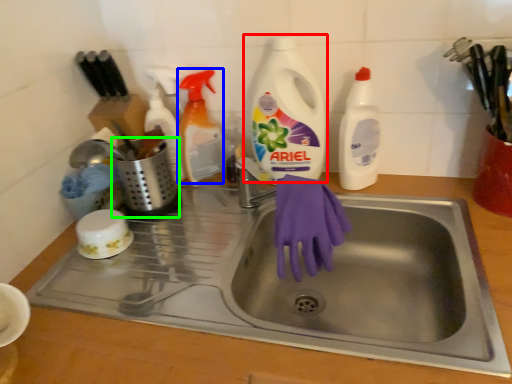
Question: Which is nearer to the cleaning product (highlighted by a red box)? cleaning product (highlighted by a blue box) or appliance (highlighted by a green box).

Choices:
 (A) cleaning product
 (B) appliance

Answer: (A)